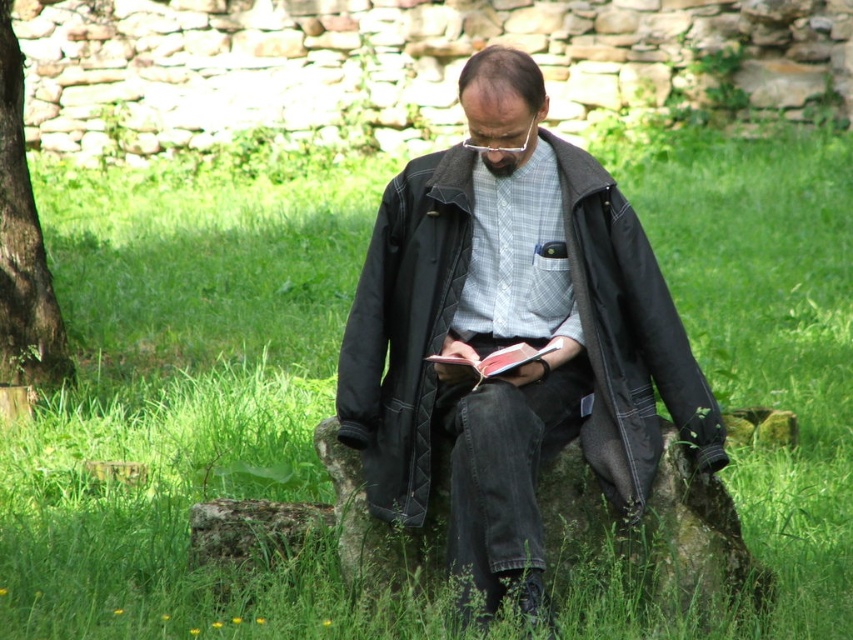
Question: Does matte black jacket at center appear on the left side of red leather book at center?

Choices:
 (A) no
 (B) yes

Answer: (A)

Question: Which of these objects is positioned closest to the dark brown bark at left?

Choices:
 (A) red leather book at center
 (B) matte black jacket at center

Answer: (B)

Question: Which object is positioned closest to the red leather book at center?

Choices:
 (A) dark brown bark at left
 (B) matte black jacket at center

Answer: (B)

Question: From the image, what is the correct spatial relationship of matte black jacket at center in relation to dark brown bark at left?

Choices:
 (A) left
 (B) right

Answer: (B)

Question: Which of these objects is positioned farthest from the dark brown bark at left?

Choices:
 (A) matte black jacket at center
 (B) red leather book at center

Answer: (B)

Question: Does matte black jacket at center appear over dark brown bark at left?

Choices:
 (A) no
 (B) yes

Answer: (A)